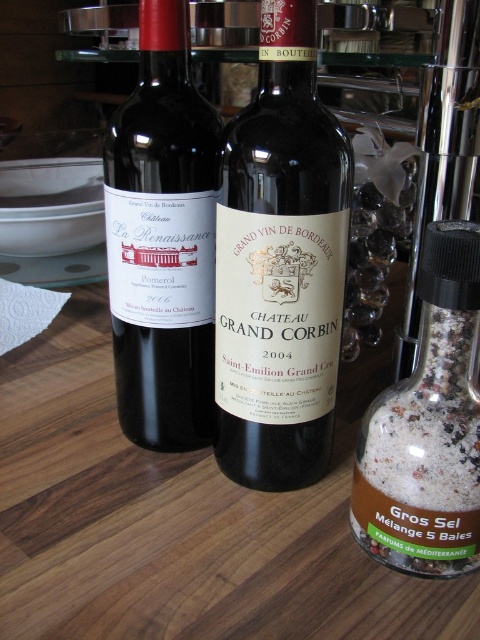
Question: Which point appears farthest from the camera in this image?

Choices:
 (A) (116, 141)
 (B) (262, 33)
 (C) (466, 305)

Answer: (A)

Question: In this image, where is matte black bottle at center located relative to white granular salt at right?

Choices:
 (A) above
 (B) below

Answer: (A)

Question: Which object is closer to the camera taking this photo?

Choices:
 (A) matte black bottle at left
 (B) white granular salt at right
 (C) matte black bottle at center

Answer: (B)

Question: Observing the image, what is the correct spatial positioning of matte black bottle at center in reference to matte black bottle at left?

Choices:
 (A) above
 (B) below

Answer: (B)

Question: Which is nearer to the matte black bottle at left?

Choices:
 (A) matte black bottle at center
 (B) white granular salt at right

Answer: (A)

Question: Is matte black bottle at center above matte black bottle at left?

Choices:
 (A) no
 (B) yes

Answer: (A)